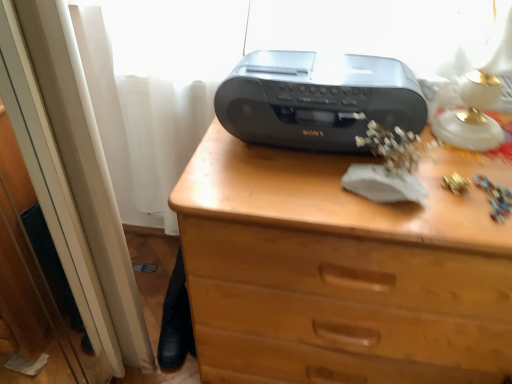
Question: From a real-world perspective, does white glossy table lamp at upper right stand above satin black radio at center?

Choices:
 (A) yes
 (B) no

Answer: (A)

Question: Does white glossy table lamp at upper right have a greater width compared to satin black radio at center?

Choices:
 (A) no
 (B) yes

Answer: (A)

Question: From a real-world perspective, is white glossy table lamp at upper right below satin black radio at center?

Choices:
 (A) no
 (B) yes

Answer: (A)

Question: Is white glossy table lamp at upper right touching satin black radio at center?

Choices:
 (A) yes
 (B) no

Answer: (B)

Question: Is white glossy table lamp at upper right far away from satin black radio at center?

Choices:
 (A) yes
 (B) no

Answer: (B)

Question: Looking at the image, does satin black radio at center seem bigger or smaller compared to white glossy table lamp at upper right?

Choices:
 (A) small
 (B) big

Answer: (B)

Question: From the image's perspective, is satin black radio at center located above or below white glossy table lamp at upper right?

Choices:
 (A) below
 (B) above

Answer: (A)

Question: Does point (265, 92) appear closer or farther from the camera than point (501, 48)?

Choices:
 (A) closer
 (B) farther

Answer: (B)

Question: From a real-world perspective, is satin black radio at center above or below white glossy table lamp at upper right?

Choices:
 (A) below
 (B) above

Answer: (A)

Question: Considering the positions of satin black radio at center and brown wooden chest of drawers at center in the image, is satin black radio at center taller or shorter than brown wooden chest of drawers at center?

Choices:
 (A) short
 (B) tall

Answer: (A)

Question: Is satin black radio at center to the left or to the right of brown wooden chest of drawers at center in the image?

Choices:
 (A) left
 (B) right

Answer: (A)

Question: Considering the positions of satin black radio at center and brown wooden chest of drawers at center in the image, is satin black radio at center wider or thinner than brown wooden chest of drawers at center?

Choices:
 (A) thin
 (B) wide

Answer: (A)

Question: From the image's perspective, relative to brown wooden chest of drawers at center, is satin black radio at center above or below?

Choices:
 (A) above
 (B) below

Answer: (A)

Question: Considering the positions of brown wooden chest of drawers at center and satin black radio at center in the image, is brown wooden chest of drawers at center taller or shorter than satin black radio at center?

Choices:
 (A) tall
 (B) short

Answer: (A)

Question: Based on their sizes in the image, would you say brown wooden chest of drawers at center is bigger or smaller than satin black radio at center?

Choices:
 (A) big
 (B) small

Answer: (A)